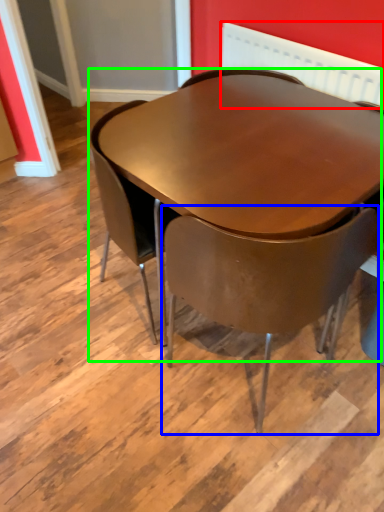
Question: Estimate the real-world distances between objects in this image. Which object is farther from radiator (highlighted by a red box), chair (highlighted by a blue box) or table (highlighted by a green box)?

Choices:
 (A) chair
 (B) table

Answer: (A)